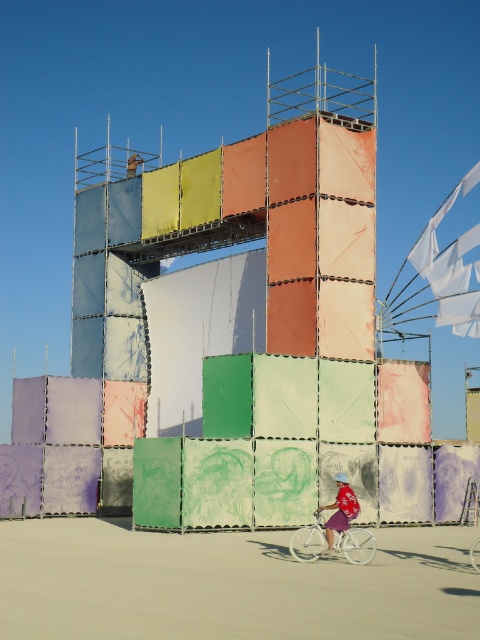
Question: Does matte pink dress at lower right have a greater width compared to white matte bicycle at center?

Choices:
 (A) no
 (B) yes

Answer: (A)

Question: Can you confirm if matte pink dress at lower right is positioned above white matte bicycle at center?

Choices:
 (A) no
 (B) yes

Answer: (B)

Question: Does white matte bicycle at lower center appear under white matte bicycle at center?

Choices:
 (A) yes
 (B) no

Answer: (B)

Question: Which point appears closest to the camera in this image?

Choices:
 (A) (343, 513)
 (B) (352, 538)
 (C) (479, 538)

Answer: (A)

Question: Which of the following is the farthest from the observer?

Choices:
 (A) (348, 490)
 (B) (477, 552)

Answer: (B)

Question: Among these objects, which one is nearest to the camera?

Choices:
 (A) matte pink dress at lower right
 (B) white matte bicycle at center
 (C) white matte bicycle at lower center

Answer: (B)